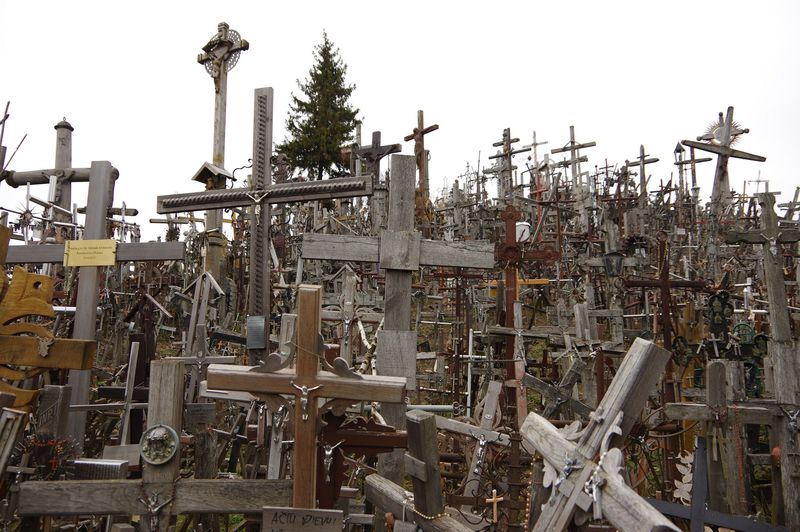
Find the location of a particular element. prayer rosary beads is located at coordinates (525, 498), (737, 452).